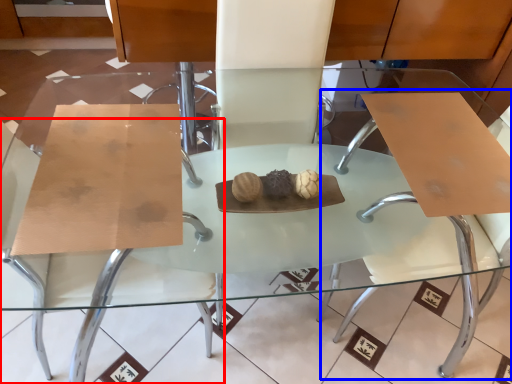
Question: Which object is further to the camera taking this photo, chair (highlighted by a red box) or swivel chair (highlighted by a blue box)?

Choices:
 (A) chair
 (B) swivel chair

Answer: (B)